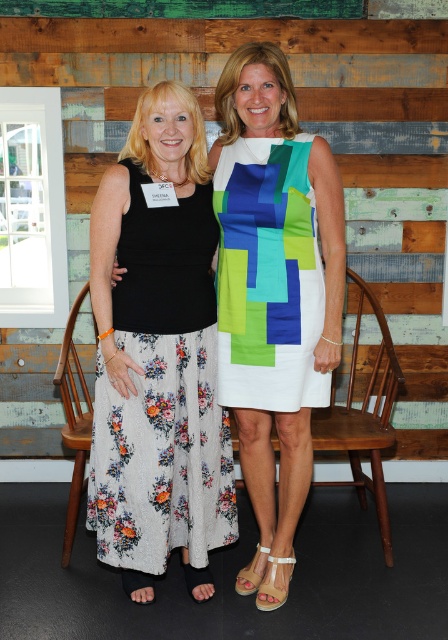
Which is above, wooden paneling at upper center or black floral skirt at left?

wooden paneling at upper center

Between point (330, 132) and point (288, 388), which one is positioned behind?

The point (330, 132) is behind.

Which is behind, point (379, 148) or point (315, 196)?

Point (379, 148)

This screenshot has height=640, width=448. Find the location of `wooden paneling at upper center`. wooden paneling at upper center is located at coordinates (305, 128).

Is point (253, 170) positioned in front of point (259, 362)?

Yes, it is.

Does black floral skirt at left have a larger size compared to silky multicolored dress at center?

Yes, black floral skirt at left is bigger than silky multicolored dress at center.

Between point (271, 227) and point (236, 163), which one is positioned in front?

Point (271, 227)

You are a GUI agent. You are given a task and a screenshot of the screen. Output one action in this format:
    pyautogui.click(x=<x>, y=<y>)
    Task: Click on the black floral skirt at left
    
    Given the screenshot: What is the action you would take?
    pyautogui.click(x=274, y=294)

Describe the element at coordinates (305, 128) in the screenshot. I see `wooden paneling at upper center` at that location.

Which is more to the left, wooden paneling at upper center or silky multicolored dress at center?

silky multicolored dress at center

Between point (214, 20) and point (298, 374), which one is positioned in front?

Point (298, 374) is in front.

Locate an element on the screen. wooden paneling at upper center is located at coordinates (305, 128).